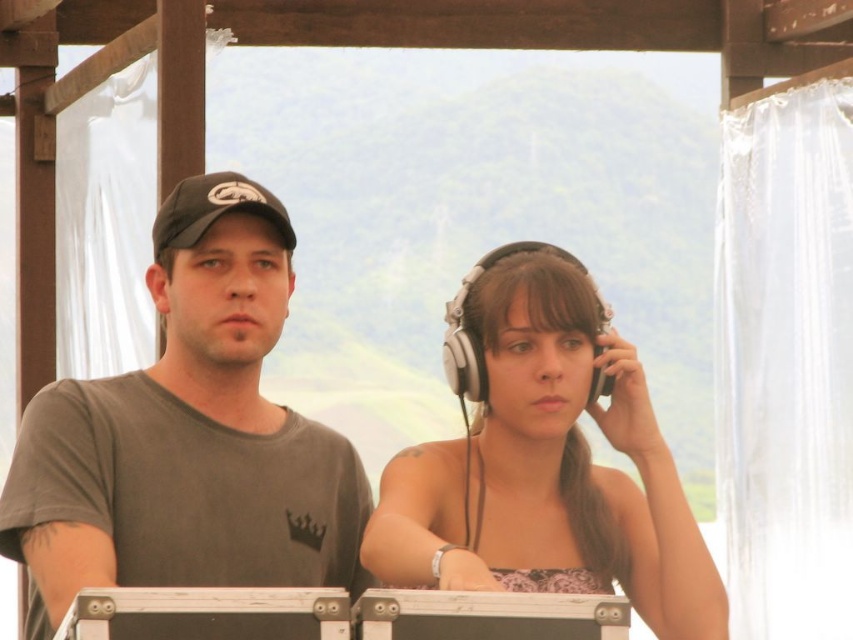
Question: Based on their relative distances, which object is nearer to the satin beige headphones at center?

Choices:
 (A) matte black baseball cap at left
 (B) gray matte t-shirt at center

Answer: (B)

Question: Which is nearer to the gray matte t-shirt at center?

Choices:
 (A) satin beige headphones at center
 (B) matte black baseball cap at left

Answer: (B)

Question: Can you confirm if gray matte t-shirt at center is bigger than satin beige headphones at center?

Choices:
 (A) no
 (B) yes

Answer: (A)

Question: Is gray matte t-shirt at center smaller than satin beige headphones at center?

Choices:
 (A) yes
 (B) no

Answer: (A)

Question: Considering the relative positions of gray matte t-shirt at center and satin beige headphones at center in the image provided, where is gray matte t-shirt at center located with respect to satin beige headphones at center?

Choices:
 (A) below
 (B) above

Answer: (B)

Question: Which object is the farthest from the satin beige headphones at center?

Choices:
 (A) matte black baseball cap at left
 (B) gray matte t-shirt at center

Answer: (A)